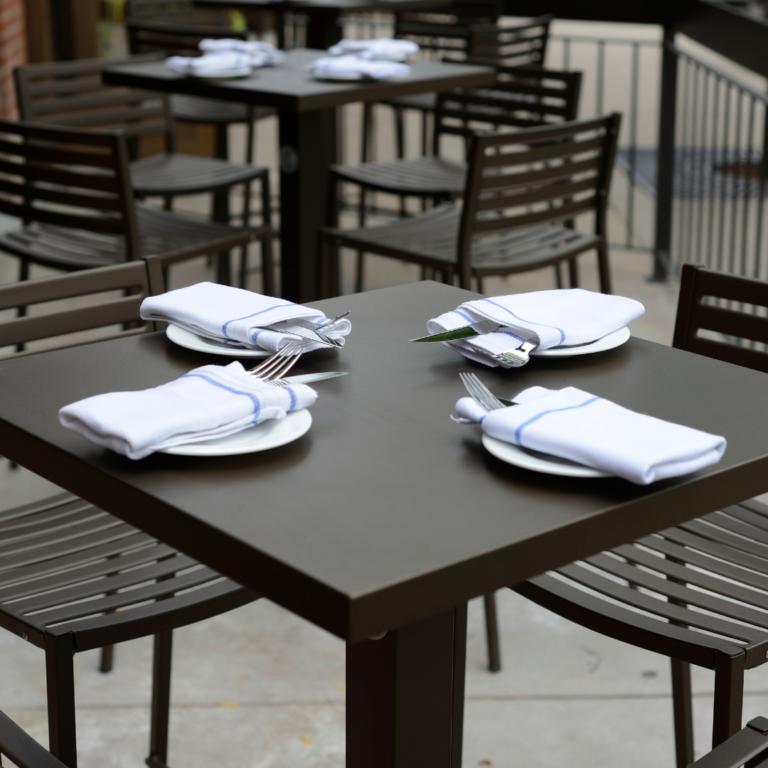
This screenshot has height=768, width=768. Identify the location of silverware. (518, 353), (459, 333), (478, 394), (273, 363), (293, 373), (313, 323), (326, 319).